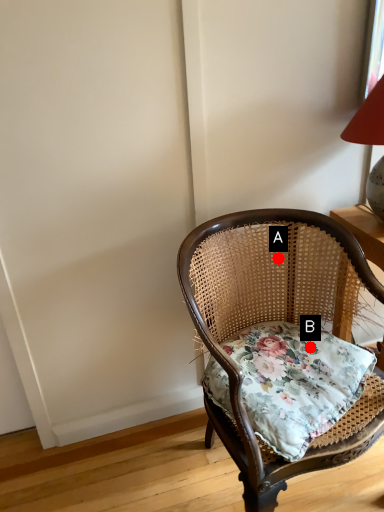
Question: Two points are circled on the image, labeled by A and B beside each circle. Which point is closer to the camera?

Choices:
 (A) A is closer
 (B) B is closer

Answer: (B)